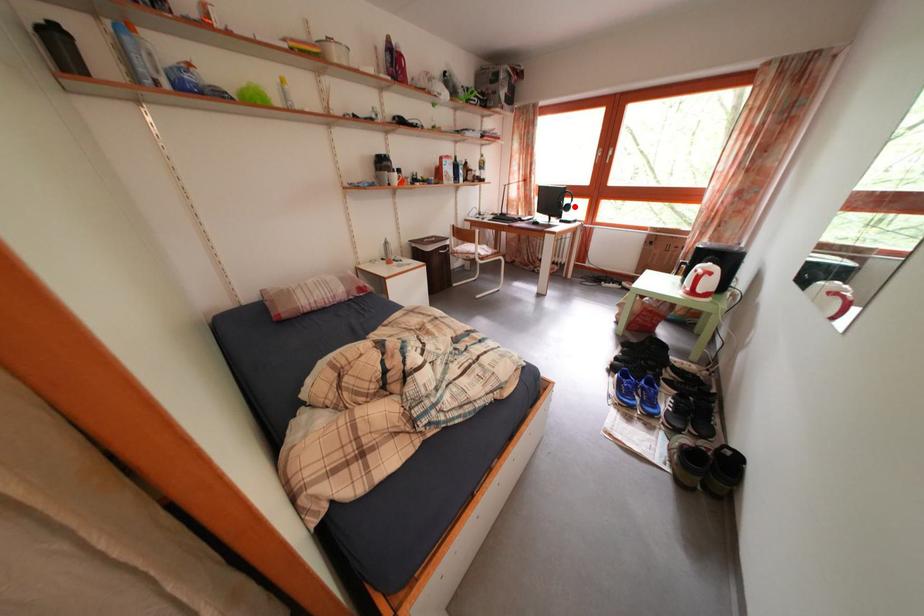
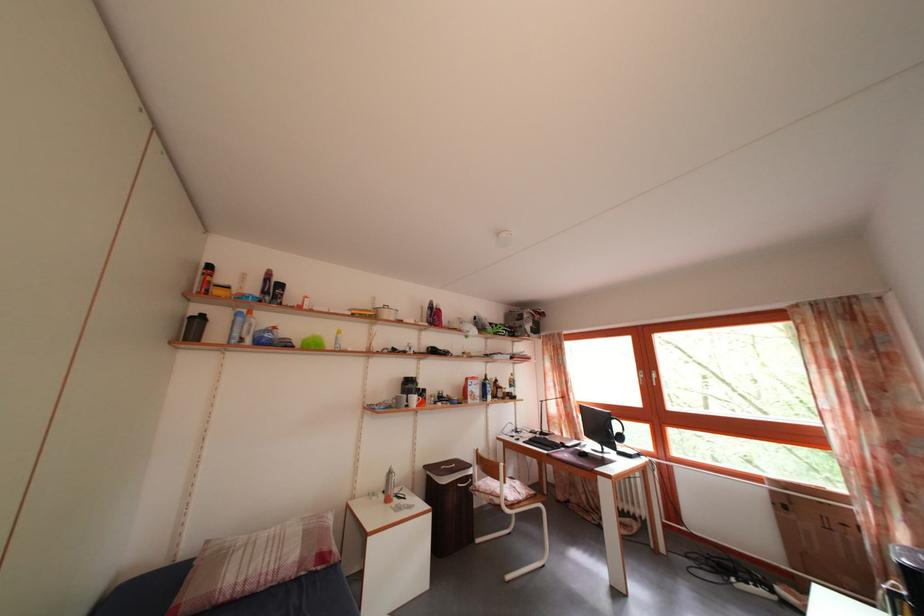
Locate, in the second image, the point that corresponds to the highlighted location in the first image.

(624, 434)